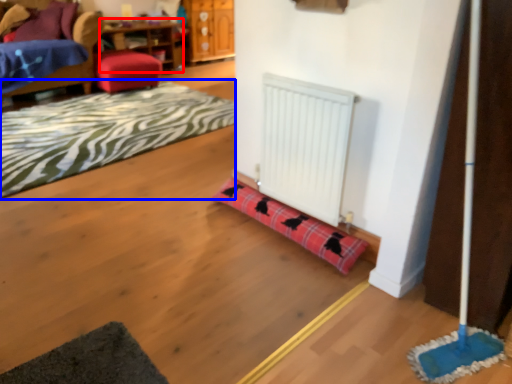
Question: Which point is closer to the camera, table (highlighted by a red box) or mat (highlighted by a blue box)?

Choices:
 (A) table
 (B) mat

Answer: (B)